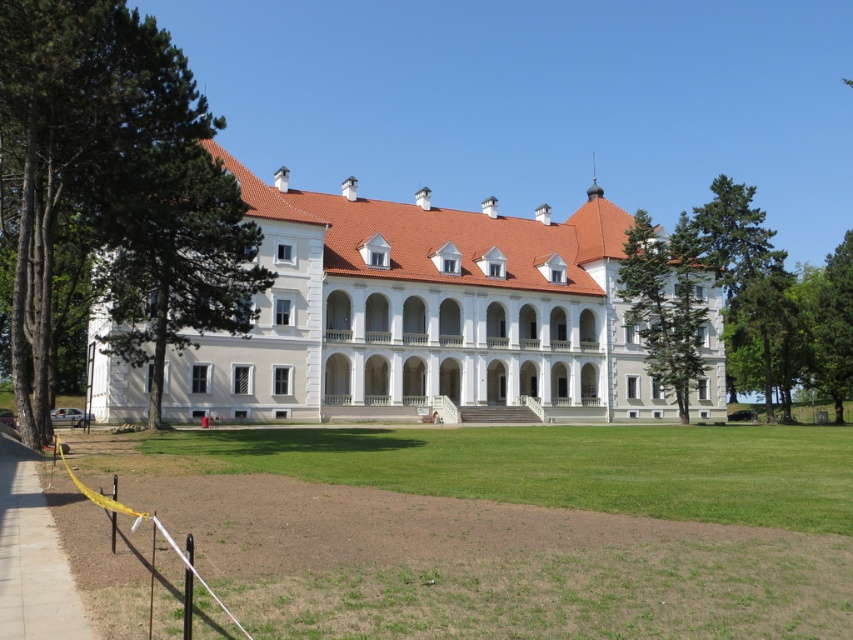
Question: Which point is closer to the camera?

Choices:
 (A) green coniferous tree at right
 (B) white smooth stone palace at center

Answer: (B)

Question: Which point is closer to the camera?

Choices:
 (A) (700, 460)
 (B) (850, 360)

Answer: (A)

Question: Which point is closer to the camera?

Choices:
 (A) (848, 282)
 (B) (660, 381)
 (C) (744, 486)

Answer: (C)

Question: Does white smooth stone palace at center appear on the right side of green leafy tree at left?

Choices:
 (A) yes
 (B) no

Answer: (A)

Question: Considering the relative positions of green leafy tree at left and green leafy tree at right in the image provided, where is green leafy tree at left located with respect to green leafy tree at right?

Choices:
 (A) left
 (B) right

Answer: (A)

Question: Where is green leafy tree at left located in relation to green textured tree at right in the image?

Choices:
 (A) below
 (B) above

Answer: (A)